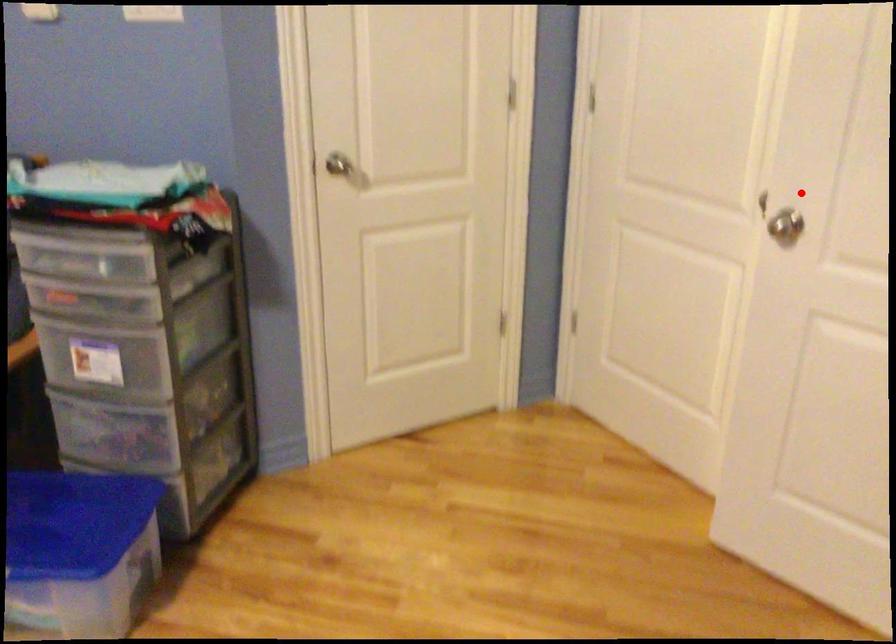
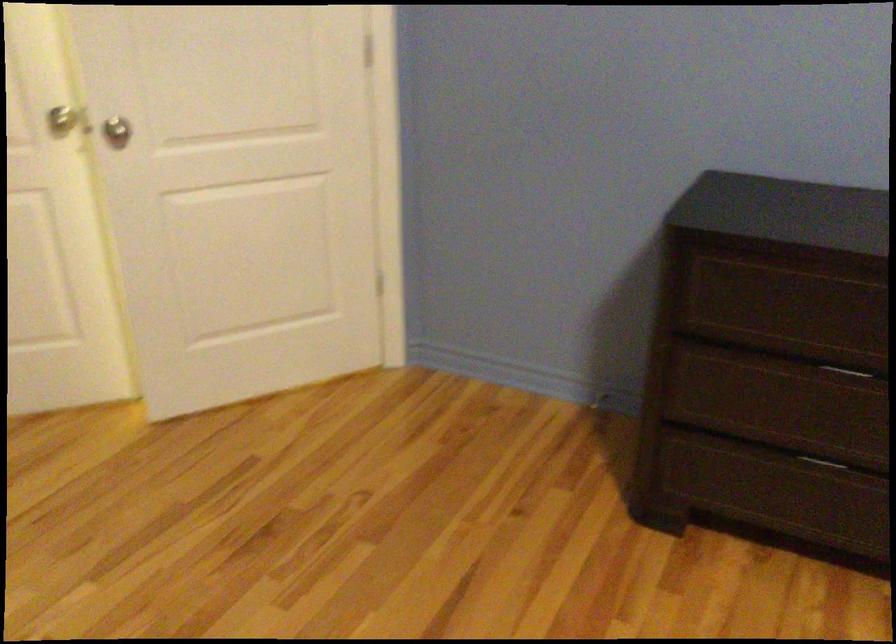
Locate, in the second image, the point that corresponds to the highlighted location in the first image.

(62, 118)